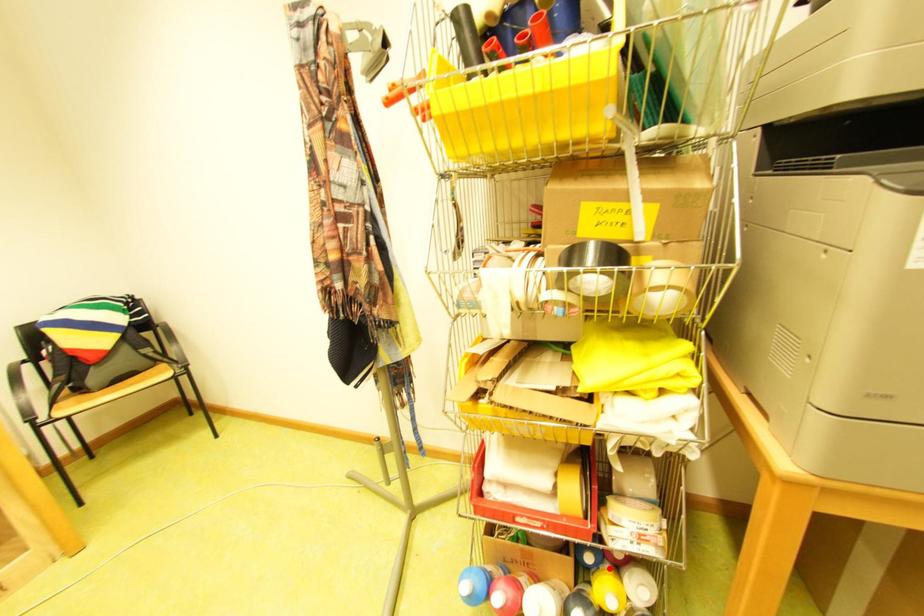
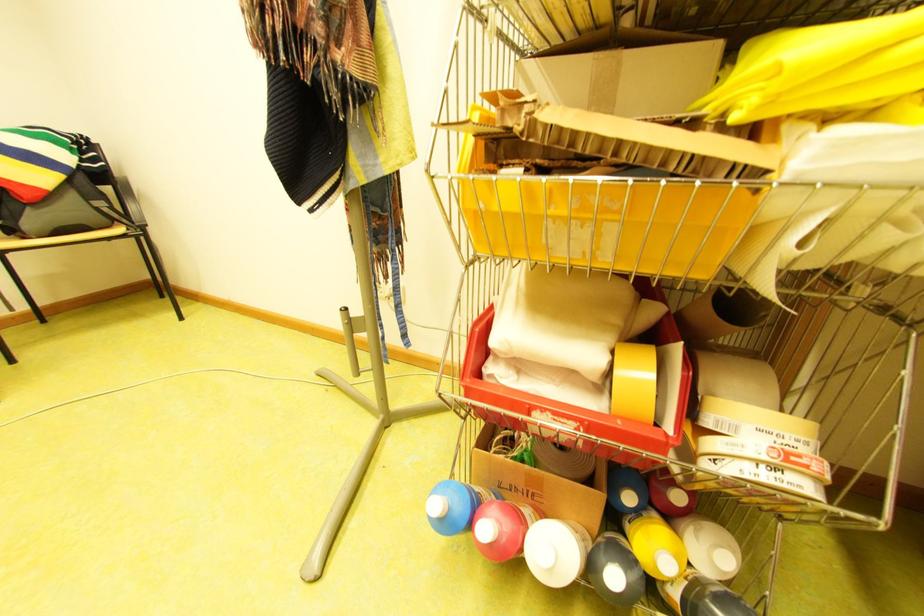
Question: I am providing you with two images of the same scene from different viewpoints. A red point is marked on the first image. At the location where the point appears in image 1, is it still visible in image 2?

Choices:
 (A) Yes
 (B) No

Answer: (A)